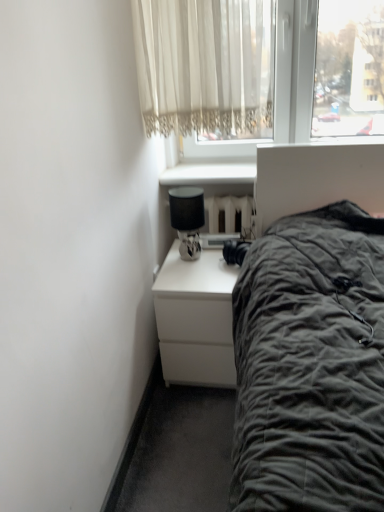
Question: Does point (195, 258) appear closer or farther from the camera than point (157, 104)?

Choices:
 (A) closer
 (B) farther

Answer: (B)

Question: From a real-world perspective, is matte black lamp at upper right positioned above or below white lace curtain at upper center?

Choices:
 (A) above
 (B) below

Answer: (B)

Question: Considering the real-world distances, which object is farthest from the matte black lamp at upper right?

Choices:
 (A) white lace curtain at upper center
 (B) white matte nightstand at lower center

Answer: (A)

Question: Which of these objects is positioned closest to the white lace curtain at upper center?

Choices:
 (A) white matte nightstand at lower center
 (B) matte black lamp at upper right

Answer: (B)